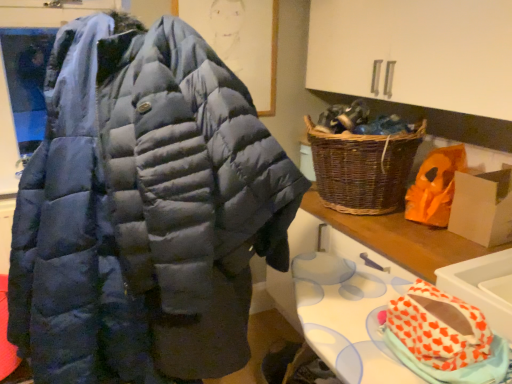
Question: Is white cardboard box at right taller than navy blue puffer jacket at center?

Choices:
 (A) no
 (B) yes

Answer: (A)

Question: Is white cardboard box at right to the right of navy blue puffer jacket at center from the viewer's perspective?

Choices:
 (A) no
 (B) yes

Answer: (B)

Question: Can you confirm if white cardboard box at right is bigger than navy blue puffer jacket at center?

Choices:
 (A) no
 (B) yes

Answer: (A)

Question: Does white cardboard box at right appear on the left side of navy blue puffer jacket at center?

Choices:
 (A) yes
 (B) no

Answer: (B)

Question: From the image's perspective, is white cardboard box at right under navy blue puffer jacket at center?

Choices:
 (A) yes
 (B) no

Answer: (B)

Question: Is white cardboard box at right further to the viewer compared to navy blue puffer jacket at center?

Choices:
 (A) no
 (B) yes

Answer: (B)

Question: Is white glossy sink at lower right further to camera compared to orange paper bag at right?

Choices:
 (A) no
 (B) yes

Answer: (A)

Question: From a real-world perspective, is white glossy sink at lower right located beneath orange paper bag at right?

Choices:
 (A) yes
 (B) no

Answer: (A)

Question: Is white glossy sink at lower right aimed at orange paper bag at right?

Choices:
 (A) no
 (B) yes

Answer: (A)

Question: Can you confirm if white glossy sink at lower right is smaller than orange paper bag at right?

Choices:
 (A) yes
 (B) no

Answer: (A)

Question: Does white glossy sink at lower right have a larger size compared to orange paper bag at right?

Choices:
 (A) yes
 (B) no

Answer: (B)

Question: From the image's perspective, does white glossy sink at lower right appear higher than orange paper bag at right?

Choices:
 (A) no
 (B) yes

Answer: (A)

Question: Is orange paper bag at right not inside orange heart-patterned fabric at lower right?

Choices:
 (A) no
 (B) yes

Answer: (B)